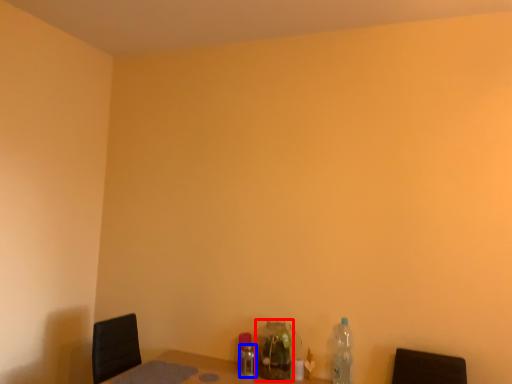
Question: Which object appears closest to the camera in this image, bottle (highlighted by a red box) or bottle (highlighted by a blue box)?

Choices:
 (A) bottle
 (B) bottle

Answer: (A)